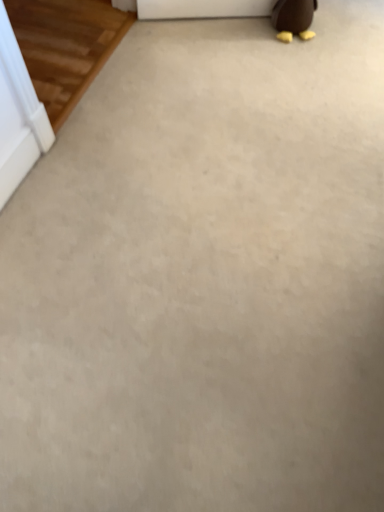
Find the location of a particular element. This screenshot has width=384, height=512. unoccupied region to the right of brown matte penguin at upper right is located at coordinates (334, 37).